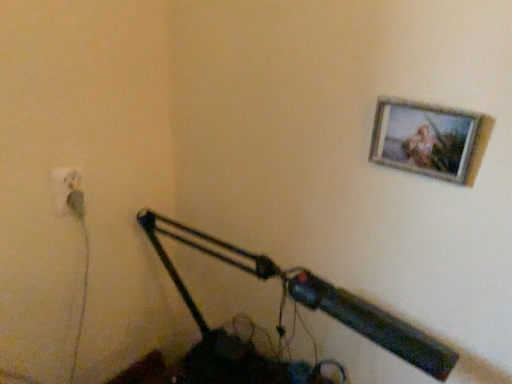
Question: Should I look upward or downward to see green rubber plug at lower left?

Choices:
 (A) down
 (B) up

Answer: (A)

Question: Is wooden frame at upper right located within green rubber plug at lower left?

Choices:
 (A) yes
 (B) no

Answer: (B)

Question: Is green rubber plug at lower left with wooden frame at upper right?

Choices:
 (A) no
 (B) yes

Answer: (A)

Question: Could you tell me if green rubber plug at lower left is turned towards wooden frame at upper right?

Choices:
 (A) no
 (B) yes

Answer: (A)

Question: From a real-world perspective, is green rubber plug at lower left on wooden frame at upper right?

Choices:
 (A) yes
 (B) no

Answer: (B)

Question: Considering the relative positions of green rubber plug at lower left and wooden frame at upper right in the image provided, is green rubber plug at lower left to the right of wooden frame at upper right from the viewer's perspective?

Choices:
 (A) yes
 (B) no

Answer: (B)

Question: Considering the relative sizes of green rubber plug at lower left and wooden frame at upper right in the image provided, is green rubber plug at lower left smaller than wooden frame at upper right?

Choices:
 (A) yes
 (B) no

Answer: (A)

Question: Is white plastic electric outlet at lower left oriented away from metallic black lamp at lower center?

Choices:
 (A) no
 (B) yes

Answer: (A)

Question: From the image's perspective, is white plastic electric outlet at lower left above metallic black lamp at lower center?

Choices:
 (A) no
 (B) yes

Answer: (B)

Question: From a real-world perspective, does white plastic electric outlet at lower left stand above metallic black lamp at lower center?

Choices:
 (A) no
 (B) yes

Answer: (B)

Question: Can you confirm if white plastic electric outlet at lower left is thinner than metallic black lamp at lower center?

Choices:
 (A) no
 (B) yes

Answer: (B)

Question: Does white plastic electric outlet at lower left have a smaller size compared to metallic black lamp at lower center?

Choices:
 (A) yes
 (B) no

Answer: (A)

Question: Is metallic black lamp at lower center completely or partially inside white plastic electric outlet at lower left?

Choices:
 (A) no
 (B) yes

Answer: (A)

Question: Is white plastic electric outlet at lower left outside wooden frame at upper right?

Choices:
 (A) yes
 (B) no

Answer: (A)